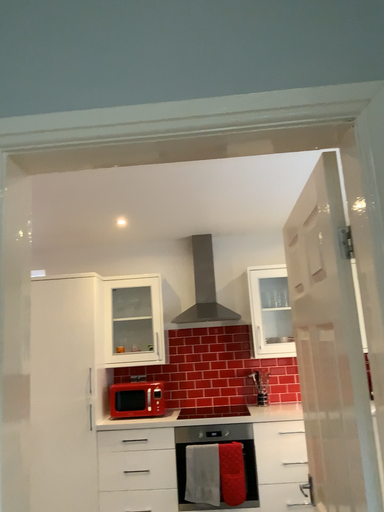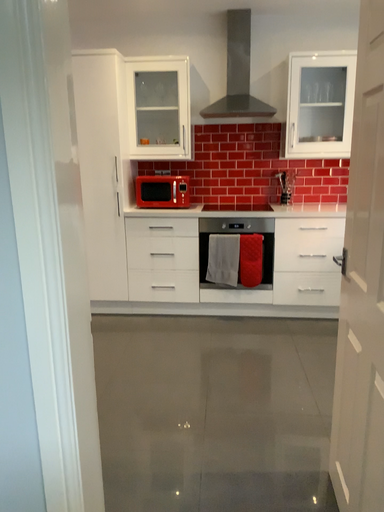
Question: How did the camera likely rotate when shooting the video?

Choices:
 (A) rotated upward
 (B) rotated downward

Answer: (B)